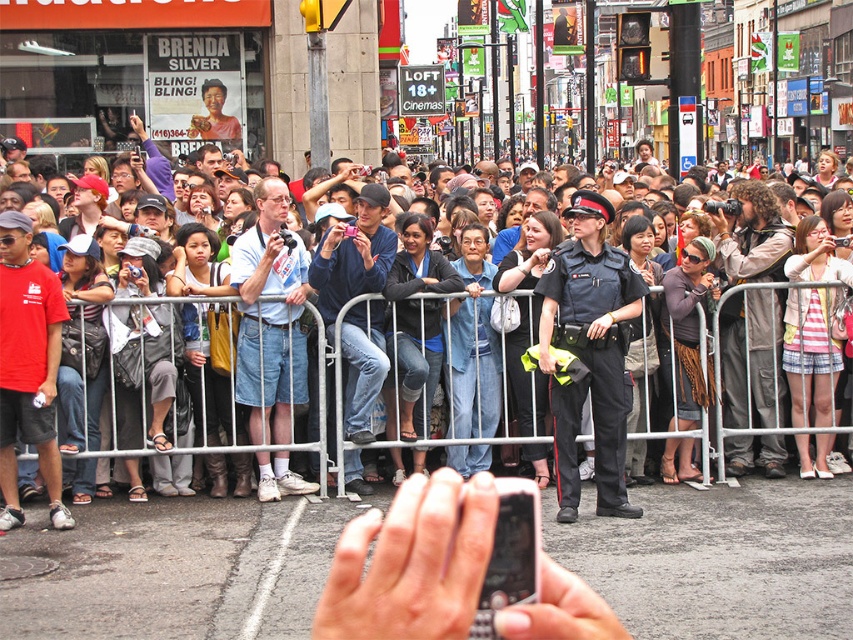
Question: Can you confirm if striped fabric skirt at center is positioned below matte black uniform at center?

Choices:
 (A) no
 (B) yes

Answer: (A)

Question: Which point is farther to the camera?

Choices:
 (A) (109, 424)
 (B) (782, 342)

Answer: (B)

Question: Among these objects, which one is farthest from the camera?

Choices:
 (A) matte black uniform at center
 (B) striped fabric skirt at center

Answer: (B)

Question: Which point appears farthest from the camera in this image?

Choices:
 (A) (790, 394)
 (B) (183, 460)

Answer: (A)

Question: Considering the relative positions of striped fabric skirt at center and matte black uniform at center in the image provided, where is striped fabric skirt at center located with respect to matte black uniform at center?

Choices:
 (A) above
 (B) below

Answer: (A)

Question: Does striped fabric skirt at center appear on the left side of matte black uniform at center?

Choices:
 (A) no
 (B) yes

Answer: (A)